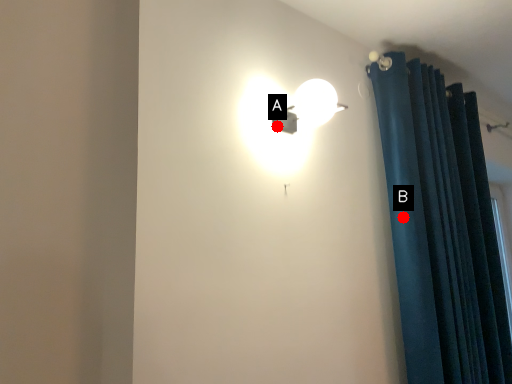
Question: Two points are circled on the image, labeled by A and B beside each circle. Which point is closer to the camera?

Choices:
 (A) A is closer
 (B) B is closer

Answer: (A)